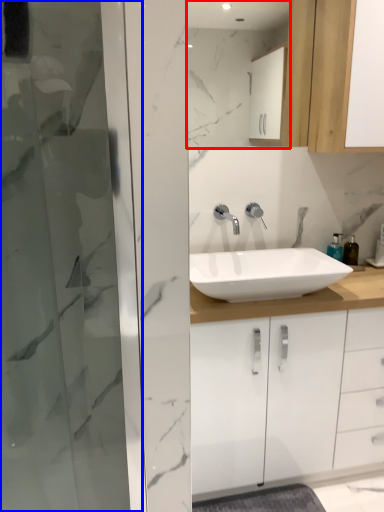
Question: Which point is closer to the camera, mirror (highlighted by a red box) or screen door (highlighted by a blue box)?

Choices:
 (A) mirror
 (B) screen door

Answer: (B)